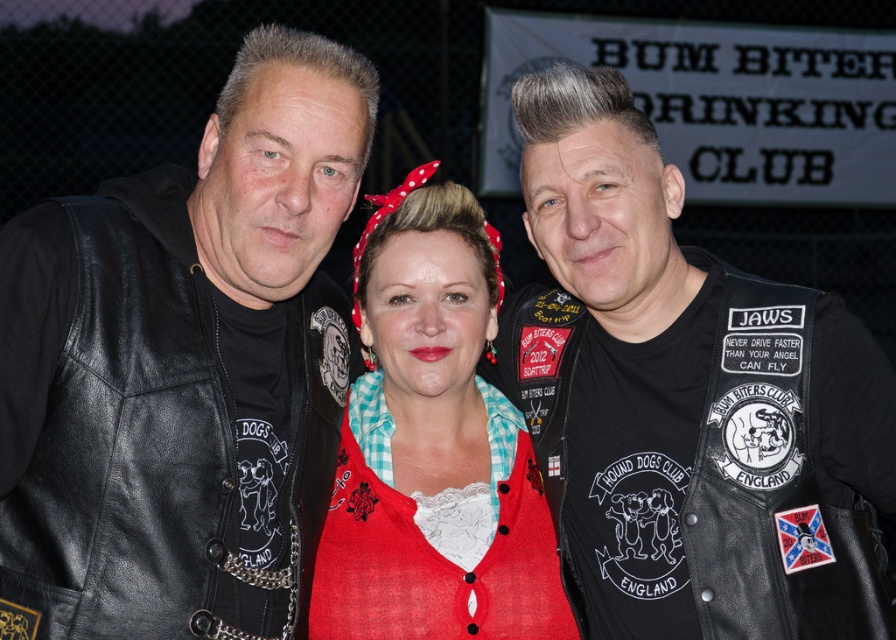
You are a photographer holding a camera and want to take a clear photo of the leather vest at center. What is the minimum distance you need to be from the vest to ensure the camera can focus properly?

The minimum distance you need to be from the leather vest at center is 3.41 meters, as that is the distance between the camera and the vest.

Consider the image. Where is the leather vest at center located in the image?

The leather vest at center is located at point 0.620 on the x axis and 0.763 on the y axis.